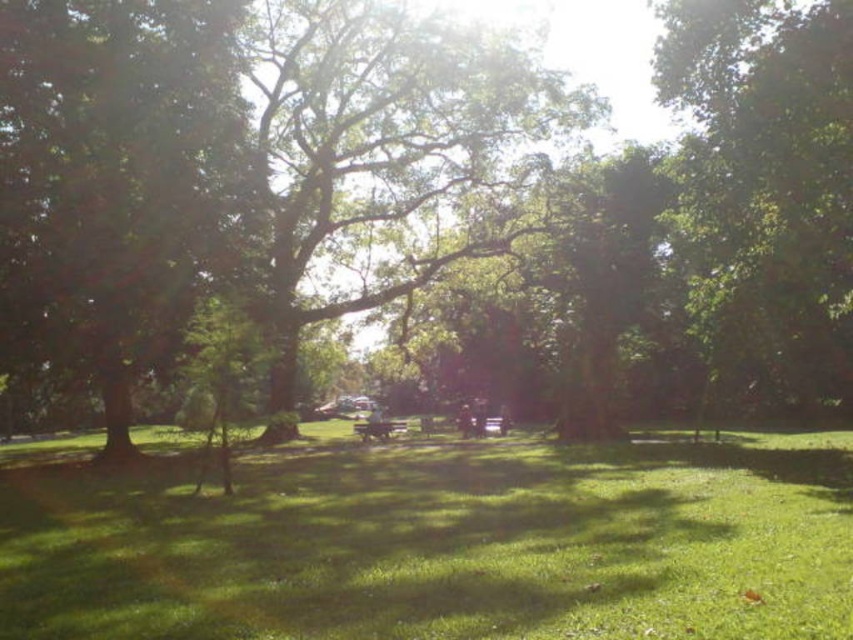
Question: Can you confirm if green grassy field at center is positioned to the right of wooden park bench at center?

Choices:
 (A) yes
 (B) no

Answer: (A)

Question: Can you confirm if green grassy field at center is positioned below green leafy tree at right?

Choices:
 (A) yes
 (B) no

Answer: (A)

Question: Can you confirm if green grassy field at center is wider than wooden park bench at center?

Choices:
 (A) yes
 (B) no

Answer: (A)

Question: Which of the following is the farthest from the observer?

Choices:
 (A) (732, 20)
 (B) (80, 554)

Answer: (A)

Question: Based on their relative distances, which object is farther from the green leafy tree at right?

Choices:
 (A) green grassy field at center
 (B) wooden park bench at center
 (C) green leafy tree at center

Answer: (B)

Question: Considering the real-world distances, which object is closest to the green grassy field at center?

Choices:
 (A) wooden park bench at center
 (B) green leafy tree at right

Answer: (B)